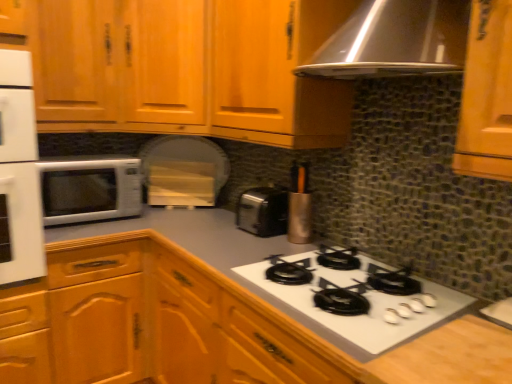
At what (x,y) coordinates should I click in order to perform the action: click on vacant space to the left of metallic silver utensil holder at upper center. Please return your answer as a coordinate pair (x, y). This screenshot has height=384, width=512. Looking at the image, I should click on (254, 237).